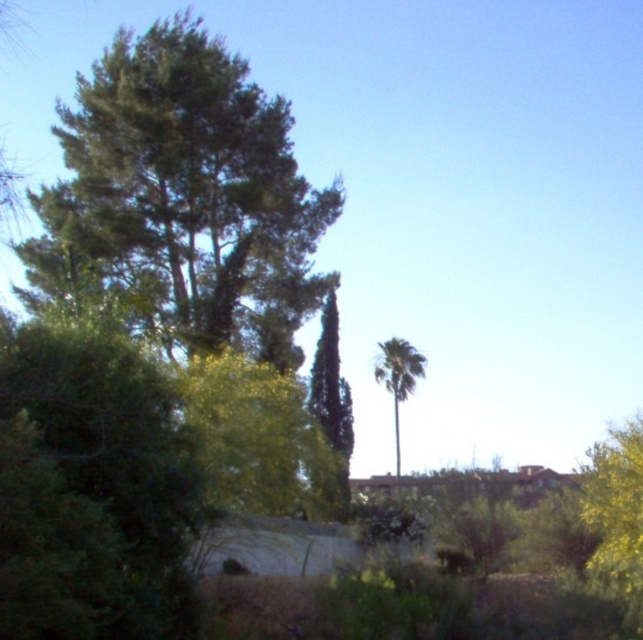
Based on the scene description, which object has a wider spread? Please choose between the green leafy tree at upper left and the green leafy palm at center.

The green leafy tree at upper left might be wider than the green leafy palm at center according to the description.